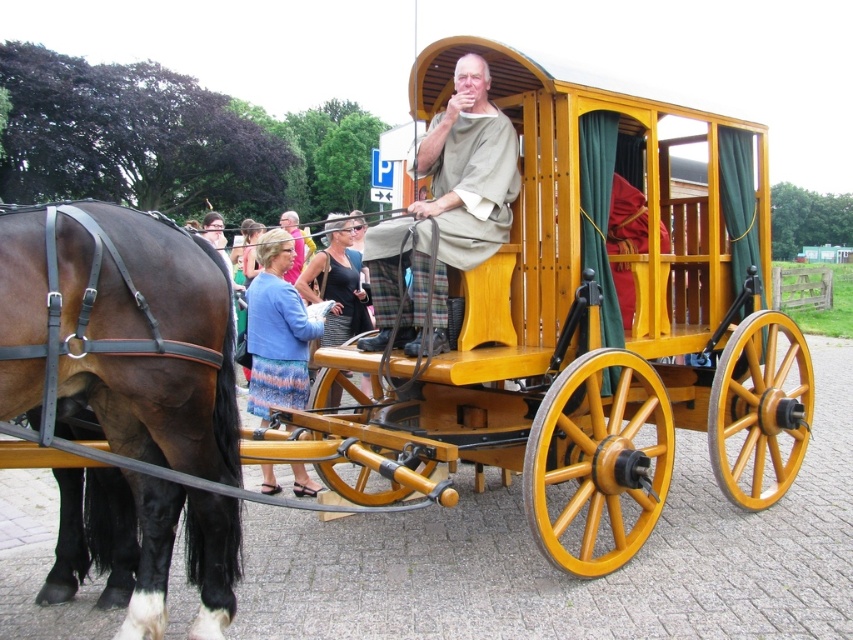
You are a costume designer preparing for a historical play. You need to decide which item, the brown leather harness at left or the blue fabric dress at lower left, can be placed on a 1.2 meter wide prop shelf. Based on their sizes, which one would fit better?

The brown leather harness at left has a larger width than the blue fabric dress at lower left. Since the shelf is 1.2 meters wide, the blue fabric dress at lower left would fit better as it is narrower than the brown leather harness at left.

You are standing in front of the carriage and need to locate the brown leather harness at left. According to the scene description, where exactly is it positioned?

The brown leather harness at left is located at point coordinates of [120,332].